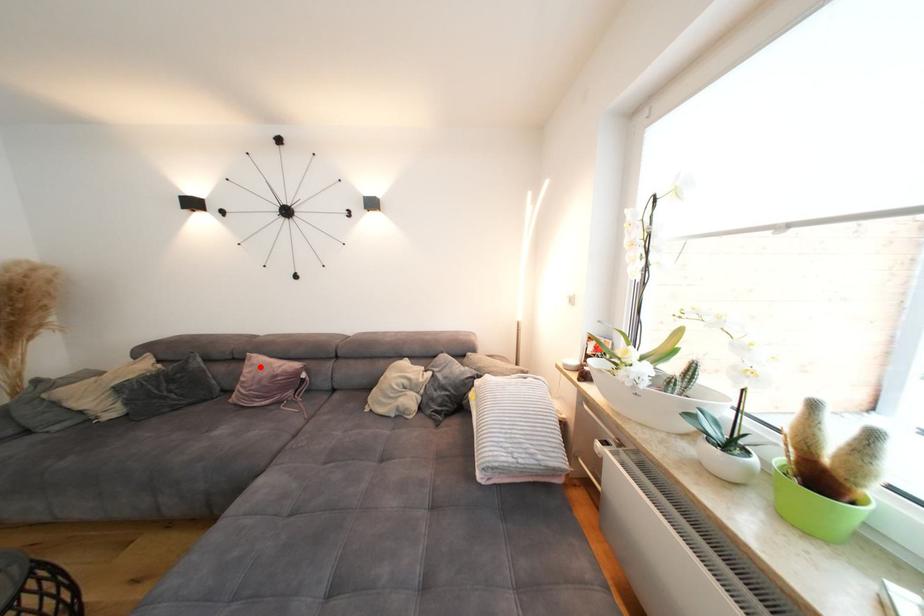
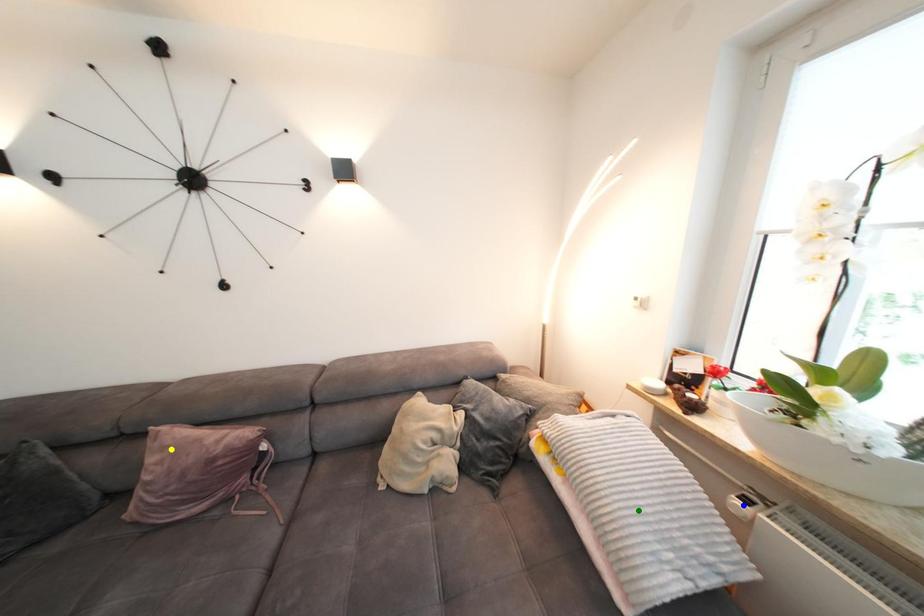
Question: I am providing you with two images of the same scene from different viewpoints. A red point is marked on the first image. You are given multiple points on the second image. Which mark in image 2 goes with the point in image 1?

Choices:
 (A) blue point
 (B) green point
 (C) yellow point

Answer: (C)